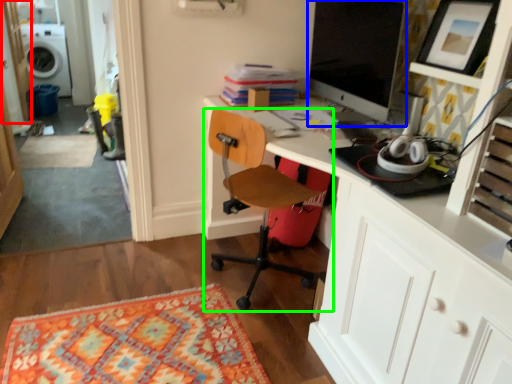
Question: Which object is the closest to the glass door (highlighted by a red box)? Choose among these: computer monitor (highlighted by a blue box) or chair (highlighted by a green box).

Choices:
 (A) computer monitor
 (B) chair

Answer: (B)